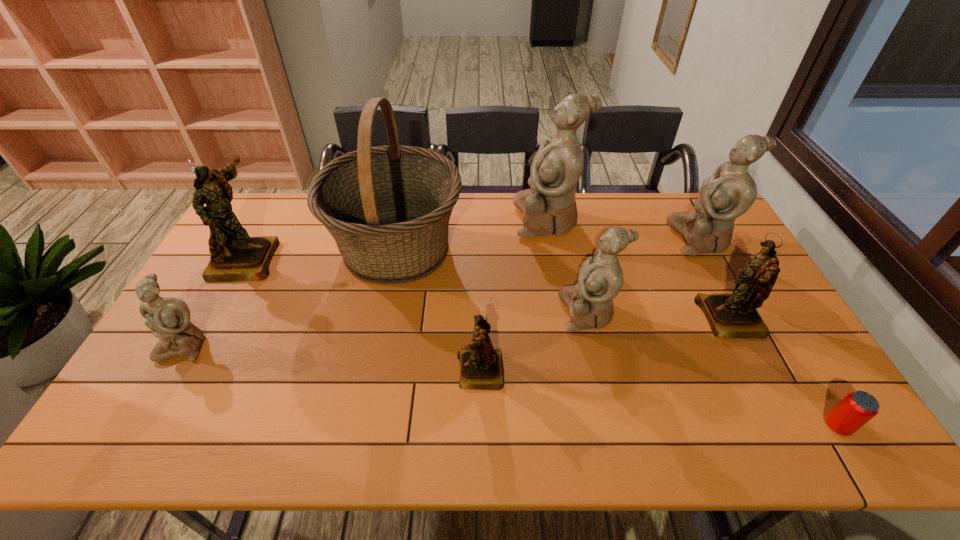
Identify the location of vacant space located on the front-facing side of the farthest gold figurine. (381, 258).

Find the location of a particular element. The image size is (960, 540). vacant space positioned on the front-facing side of the second biggest gold figurine is located at coordinates (562, 319).

Identify the location of free region located 0.400m on the front-facing side of the second biggest gold figurine. The image size is (960, 540). (562, 319).

What are the coordinates of `free space located on the front-facing side of the second biggest gold figurine` in the screenshot? It's located at (629, 319).

Where is `free location located 0.130m on the front-facing side of the second smallest white figurine`? free location located 0.130m on the front-facing side of the second smallest white figurine is located at coordinates (516, 312).

The height and width of the screenshot is (540, 960). I want to click on vacant space located 0.060m on the front-facing side of the second smallest white figurine, so click(540, 312).

Locate an element on the screen. free space located 0.350m on the front-facing side of the second smallest white figurine is located at coordinates (440, 312).

In order to click on vacant space situated on the front-facing side of the smallest white figurine in this screenshot , I will do `click(122, 451)`.

Find the location of a particular element. This screenshot has width=960, height=540. vacant space located on the front-facing side of the nearest gold figurine is located at coordinates (340, 372).

Find the location of a particular element. This screenshot has width=960, height=540. free space located on the front-facing side of the nearest gold figurine is located at coordinates (383, 372).